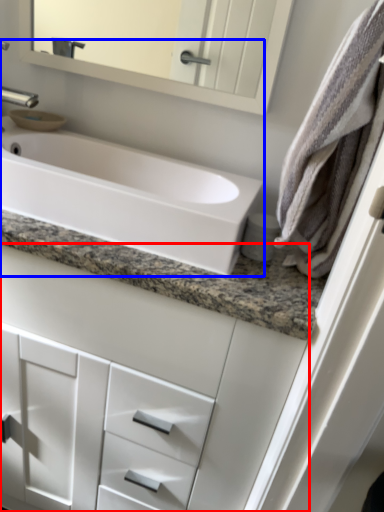
Question: Which object is closer to the camera taking this photo, bathroom cabinet (highlighted by a red box) or sink (highlighted by a blue box)?

Choices:
 (A) bathroom cabinet
 (B) sink

Answer: (A)